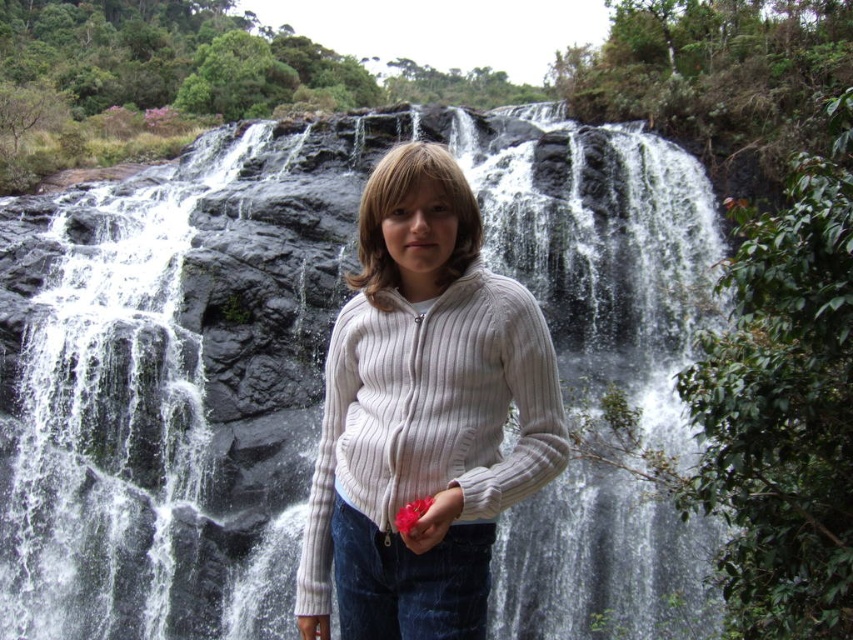
Question: Does white ribbed sweater at center appear on the right side of matte pink flower at center?

Choices:
 (A) no
 (B) yes

Answer: (A)

Question: Is gray rock waterfall at center positioned behind white ribbed sweater at center?

Choices:
 (A) yes
 (B) no

Answer: (A)

Question: Which object is farther from the camera taking this photo?

Choices:
 (A) gray rock waterfall at center
 (B) matte white hand at center

Answer: (A)

Question: Which object appears farthest from the camera in this image?

Choices:
 (A) matte white hand at center
 (B) gray rock waterfall at center
 (C) matte pink flower at center
 (D) white ribbed sweater at center

Answer: (B)

Question: In this image, where is gray rock waterfall at center located relative to matte pink flower at center?

Choices:
 (A) below
 (B) above

Answer: (B)

Question: Which point is closer to the camera?

Choices:
 (A) (329, 636)
 (B) (442, 282)
 (C) (436, 513)
 (D) (128, 497)

Answer: (C)